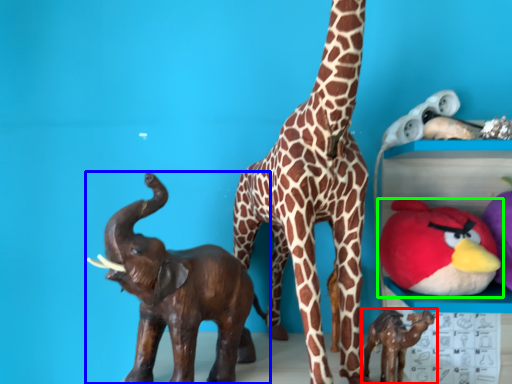
Question: Based on their relative distances, which object is farther from toy (highlighted by a red box)? Choose from toy (highlighted by a blue box) and toy (highlighted by a green box).

Choices:
 (A) toy
 (B) toy

Answer: (A)